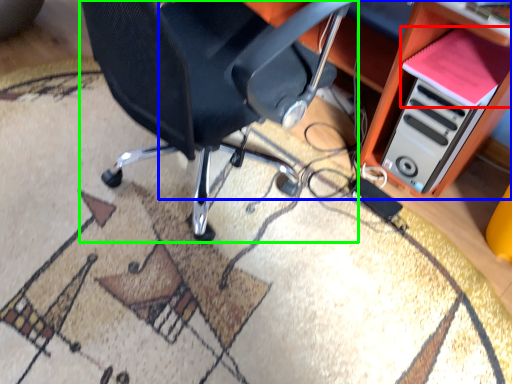
Question: Considering the real-world distances, which object is farthest from book (highlighted by a red box)? computer desk (highlighted by a blue box) or chair (highlighted by a green box)?

Choices:
 (A) computer desk
 (B) chair

Answer: (B)